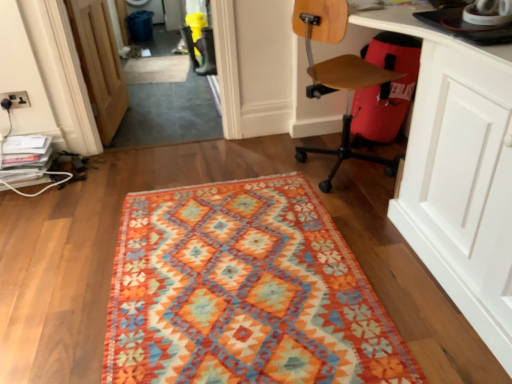
Locate an element on the screen. empty space that is ontop of textured woolen rug at center is located at coordinates (236, 269).